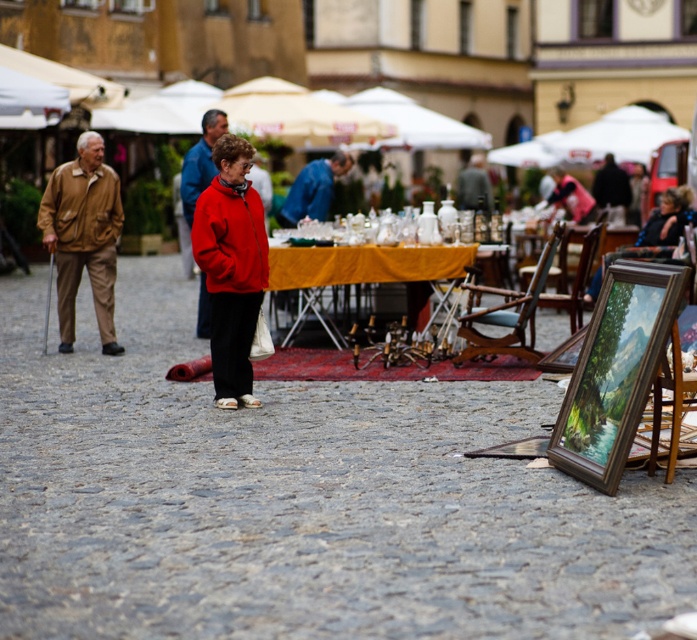
Question: Which point is closer to the camera?

Choices:
 (A) (314, 186)
 (B) (105, 186)
 (C) (206, 116)

Answer: (B)

Question: Which object is positioned closest to the yellow cloth-covered table at center?

Choices:
 (A) matte brown jacket at left
 (B) matte red jacket at center
 (C) blue fabric jacket at center
 (D) brown leather jacket at left

Answer: (A)

Question: Among these points, which one is nearest to the camera?

Choices:
 (A) (86, 212)
 (B) (107, 230)

Answer: (A)

Question: Is brown leather jacket at left above blue fabric jacket at center?

Choices:
 (A) no
 (B) yes

Answer: (A)

Question: Does yellow cloth-covered table at center lie in front of blue fabric jacket at center?

Choices:
 (A) no
 (B) yes

Answer: (B)

Question: Where is matte red jacket at center located in relation to brown leather jacket at left in the image?

Choices:
 (A) right
 (B) left

Answer: (A)